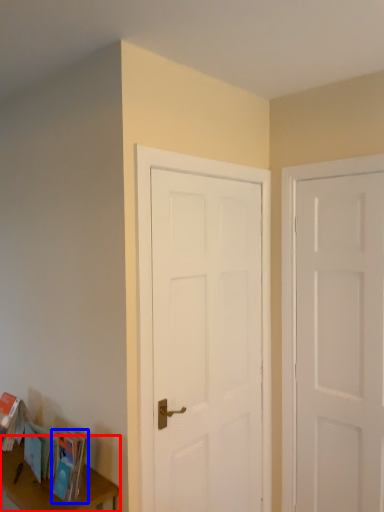
Question: Which of the following is the farthest to the observer, table (highlighted by a red box) or paperback book (highlighted by a blue box)?

Choices:
 (A) table
 (B) paperback book

Answer: (B)